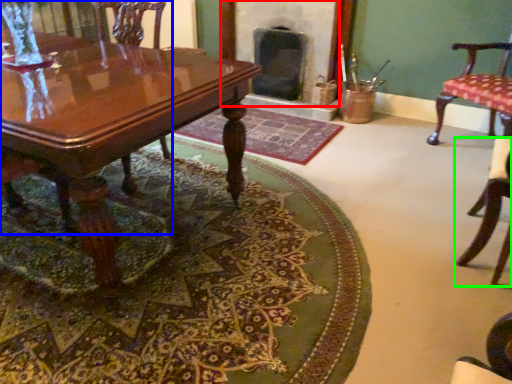
Question: Which object is the farthest from fireplace (highlighted by a red box)? Choose among these: chair (highlighted by a blue box) or chair (highlighted by a green box).

Choices:
 (A) chair
 (B) chair

Answer: (A)